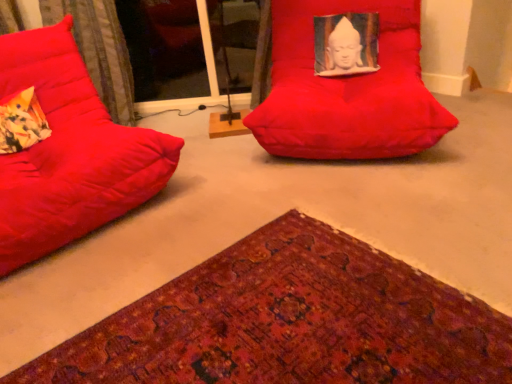
Question: Is transparent glass door at upper center positioned far away from matte red beanbag at center, which is the 1th furniture from right to left?

Choices:
 (A) yes
 (B) no

Answer: (A)

Question: From a real-world perspective, is transparent glass door at upper center beneath matte red beanbag at center, positioned as the 2th furniture in left-to-right order?

Choices:
 (A) yes
 (B) no

Answer: (A)

Question: Is transparent glass door at upper center turned away from matte red beanbag at center, positioned as the 2th furniture in left-to-right order?

Choices:
 (A) no
 (B) yes

Answer: (A)

Question: Does transparent glass door at upper center have a greater height compared to matte red beanbag at center, positioned as the 2th furniture in left-to-right order?

Choices:
 (A) yes
 (B) no

Answer: (A)

Question: From a real-world perspective, is transparent glass door at upper center on matte red beanbag at center, which is the 1th furniture from right to left?

Choices:
 (A) yes
 (B) no

Answer: (B)

Question: Does transparent glass door at upper center appear on the left side of matte red beanbag at center, which is the 1th furniture from right to left?

Choices:
 (A) yes
 (B) no

Answer: (A)

Question: Is floral fabric pillow at left to the left of matte red bean bag at left, which ranks as the first furniture in left-to-right order, from the viewer's perspective?

Choices:
 (A) no
 (B) yes

Answer: (B)

Question: Does floral fabric pillow at left come in front of matte red bean bag at left, the 2th furniture when ordered from right to left?

Choices:
 (A) no
 (B) yes

Answer: (A)

Question: Does floral fabric pillow at left have a lesser width compared to matte red bean bag at left, which ranks as the first furniture in left-to-right order?

Choices:
 (A) yes
 (B) no

Answer: (A)

Question: Is floral fabric pillow at left looking in the opposite direction of matte red bean bag at left, the 2th furniture when ordered from right to left?

Choices:
 (A) no
 (B) yes

Answer: (B)

Question: Is floral fabric pillow at left directly adjacent to matte red bean bag at left, the 2th furniture when ordered from right to left?

Choices:
 (A) no
 (B) yes

Answer: (A)

Question: Is floral fabric pillow at left further to the viewer compared to matte red bean bag at left, which ranks as the first furniture in left-to-right order?

Choices:
 (A) no
 (B) yes

Answer: (B)

Question: Considering the relative sizes of matte red bean bag at left, which ranks as the first furniture in left-to-right order, and velvet-like fabric at left in the image provided, is matte red bean bag at left, which ranks as the first furniture in left-to-right order, bigger than velvet-like fabric at left?

Choices:
 (A) no
 (B) yes

Answer: (B)